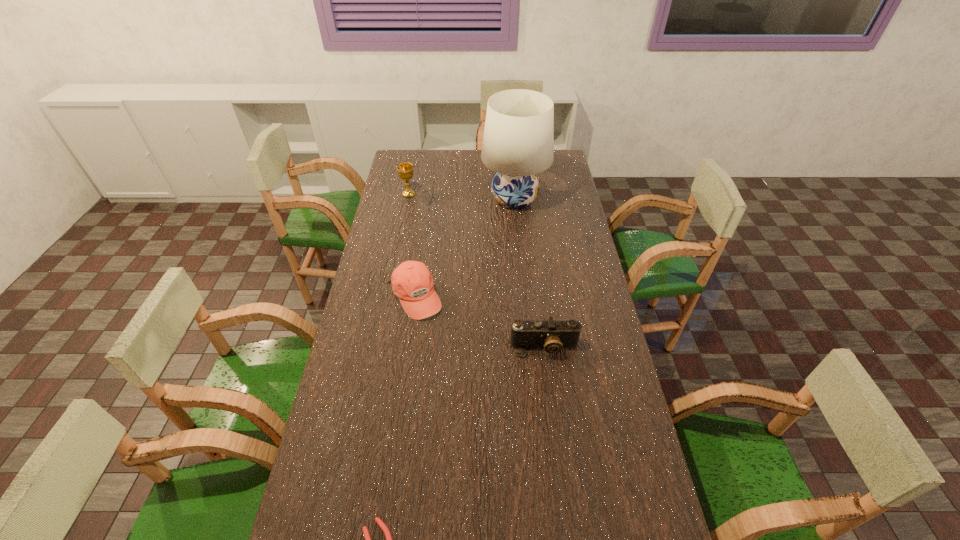
Locate an element on the screen. The image size is (960, 540). lampshade is located at coordinates (518, 143).

You are a GUI agent. You are given a task and a screenshot of the screen. Output one action in this format:
    pyautogui.click(x=<x>, y=<y>)
    Task: Click on the chalice
    The width and height of the screenshot is (960, 540).
    Given the screenshot: What is the action you would take?
    pyautogui.click(x=405, y=170)

The image size is (960, 540). In order to click on baseball cap in this screenshot , I will do `click(412, 282)`.

Identify the location of camera. This screenshot has height=540, width=960. (551, 335).

What are the coordinates of `vacant space located on the front-facing side of the tallest object` in the screenshot? It's located at (420, 199).

Image resolution: width=960 pixels, height=540 pixels. I want to click on vacant space located on the front-facing side of the tallest object, so click(x=469, y=199).

The width and height of the screenshot is (960, 540). I want to click on blank area located 0.130m on the front-facing side of the tallest object, so click(452, 199).

What are the coordinates of `vacant point located on the right of the second tallest object` in the screenshot? It's located at (449, 195).

You are a GUI agent. You are given a task and a screenshot of the screen. Output one action in this format:
    pyautogui.click(x=<x>, y=<y>)
    Task: Click on the vacant space located 0.080m on the back of the baseball cap
    
    Given the screenshot: What is the action you would take?
    pyautogui.click(x=420, y=260)

The image size is (960, 540). In order to click on vacant area situated 0.250m on the front-facing side of the camera in this screenshot , I will do `click(555, 435)`.